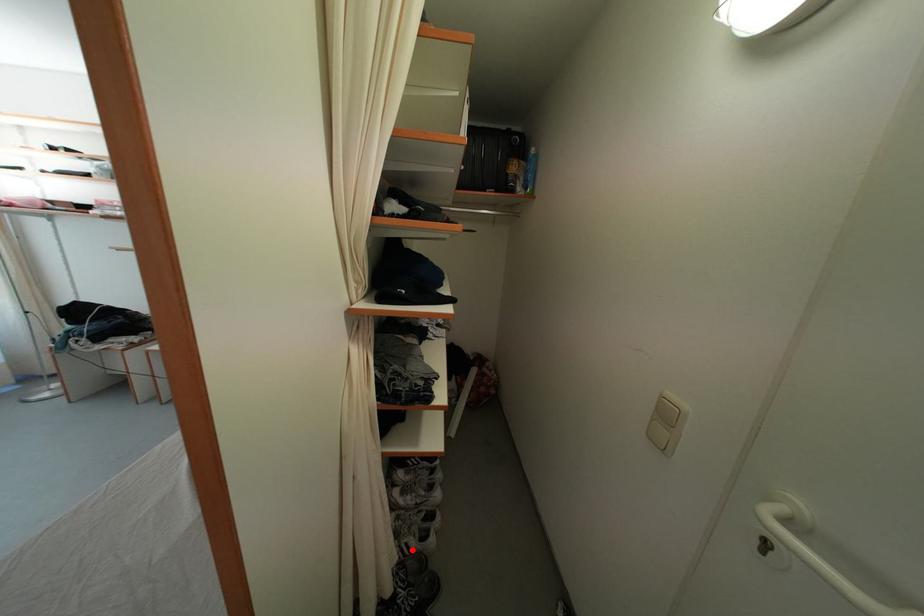
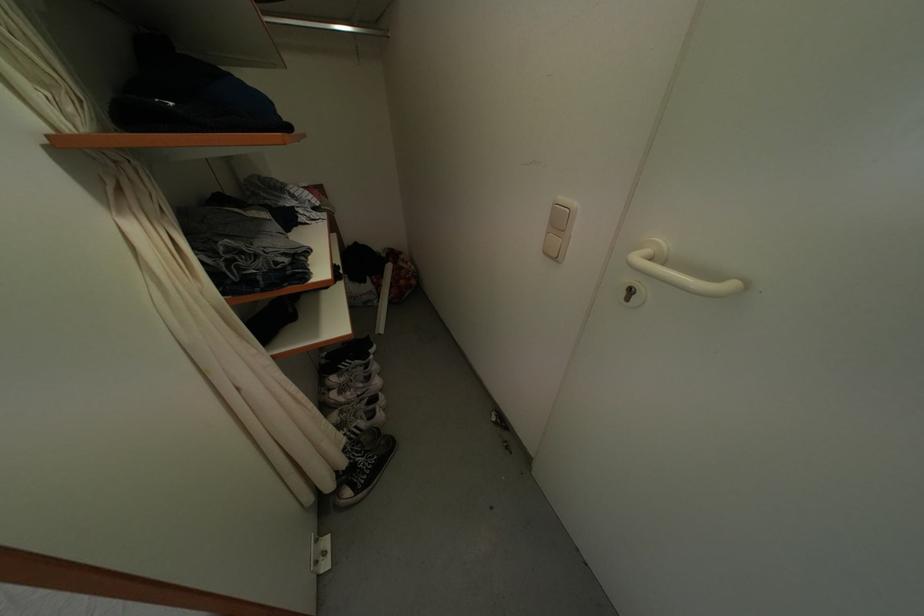
In the second image, find the point that corresponds to the highlighted location in the first image.

(361, 432)